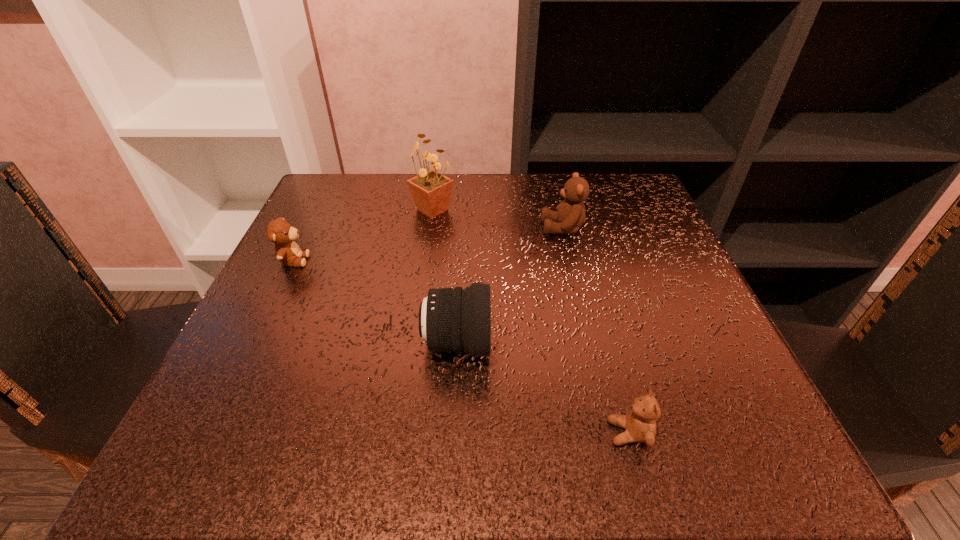
I want to click on vacant space in between the tallest teddy bear and the tallest object, so click(497, 219).

This screenshot has width=960, height=540. In order to click on unoccupied position between the telephoto lens and the nearest object in this screenshot , I will do `click(543, 388)`.

The image size is (960, 540). I want to click on vacant point located between the telephoto lens and the nearest object, so click(x=543, y=388).

Where is `free space that is in between the second farthest teddy bear and the telephoto lens`? free space that is in between the second farthest teddy bear and the telephoto lens is located at coordinates (375, 302).

Locate an element on the screen. This screenshot has width=960, height=540. empty location between the nearest teddy bear and the telephoto lens is located at coordinates [543, 388].

This screenshot has width=960, height=540. Find the location of `vacant space that is in between the fourth farthest object and the tallest teddy bear`. vacant space that is in between the fourth farthest object and the tallest teddy bear is located at coordinates (510, 286).

Identify which object is the third closest to the second nearest teddy bear. Please provide its 2D coordinates. Your answer should be formatted as a tuple, i.e. [(x, y)], where the tuple contains the x and y coordinates of a point satisfying the conditions above.

[(570, 215)]

Where is `object that is the fourth nearest to the second nearest object`? This screenshot has width=960, height=540. object that is the fourth nearest to the second nearest object is located at coordinates (431, 191).

Locate which teddy bear is the second closest to the tallest teddy bear. Please provide its 2D coordinates. Your answer should be formatted as a tuple, i.e. [(x, y)], where the tuple contains the x and y coordinates of a point satisfying the conditions above.

[(279, 231)]

Identify which teddy bear is the nearest to the second nearest teddy bear. Please provide its 2D coordinates. Your answer should be formatted as a tuple, i.e. [(x, y)], where the tuple contains the x and y coordinates of a point satisfying the conditions above.

[(570, 215)]